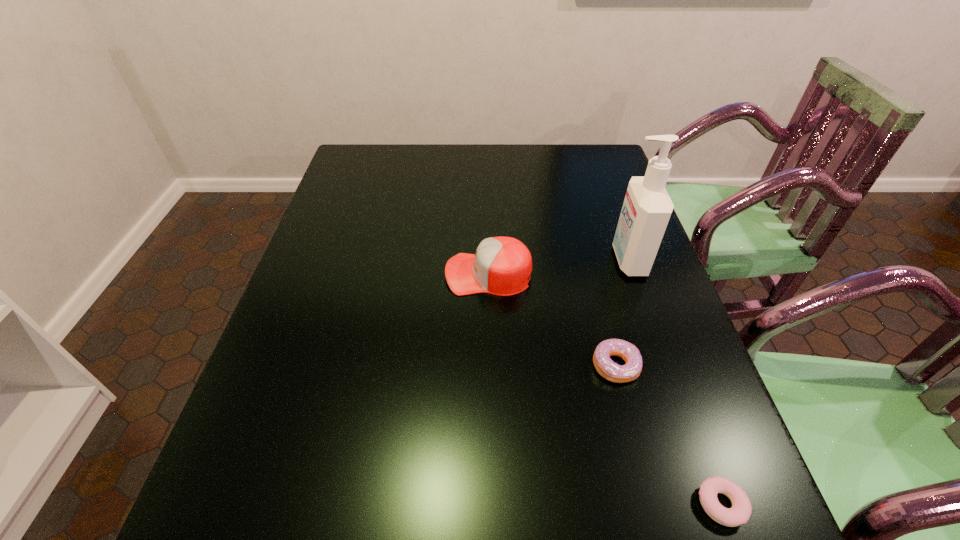
Locate an element on the screen. This screenshot has height=540, width=960. vacant space that satisfies the following two spatial constraints: 1. on the front-facing side of the third shortest object; 2. on the back side of the nearest object is located at coordinates (492, 504).

Where is `blank area in the image that satisfies the following two spatial constraints: 1. on the front-facing side of the nearer doughnut; 2. on the right side of the baseball cap`? blank area in the image that satisfies the following two spatial constraints: 1. on the front-facing side of the nearer doughnut; 2. on the right side of the baseball cap is located at coordinates (492, 504).

At what (x,y) coordinates should I click in order to perform the action: click on vacant position in the image that satisfies the following two spatial constraints: 1. on the front-facing side of the left doughnut; 2. on the right side of the baseball cap. Please return your answer as a coordinate pair (x, y). This screenshot has height=540, width=960. Looking at the image, I should click on (490, 366).

Locate an element on the screen. This screenshot has height=540, width=960. vacant space that satisfies the following two spatial constraints: 1. on the front-facing side of the nearest object; 2. on the left side of the leftmost object is located at coordinates (492, 504).

The image size is (960, 540). Identify the location of free space that satisfies the following two spatial constraints: 1. on the front-facing side of the leftmost object; 2. on the left side of the nearer doughnut. (492, 504).